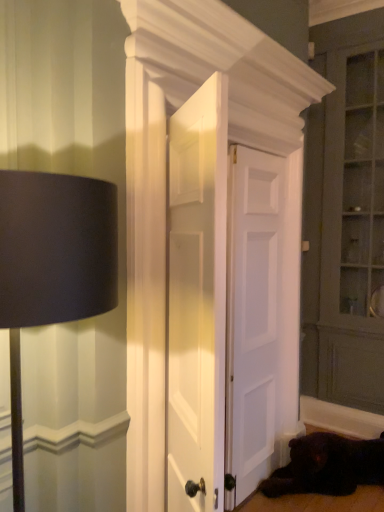
Question: From the image's perspective, relative to matte gray dresser at right, is white painted wood door at center, placed as the 2th door when sorted from front to back, above or below?

Choices:
 (A) below
 (B) above

Answer: (A)

Question: Is white painted wood door at center, placed as the 2th door when sorted from front to back, wider or thinner than matte gray dresser at right?

Choices:
 (A) thin
 (B) wide

Answer: (A)

Question: Which is farther from the white painted wood door at center, placed as the 2th door when sorted from front to back?

Choices:
 (A) white wooden door at center, arranged as the first door when viewed from the front
 (B) white matte door at center, which is the first door from back to front
 (C) matte gray dresser at right
 (D) black matte lampshade at left
 (E) shiny black fur at lower right

Answer: (D)

Question: Which object is the closest to the white matte door at center, which is the first door from back to front?

Choices:
 (A) matte gray dresser at right
 (B) white painted wood door at center, placed as the 2th door when sorted from front to back
 (C) white wooden door at center, which ranks as the 3th door in back-to-front order
 (D) shiny black fur at lower right
 (E) black matte lampshade at left

Answer: (B)